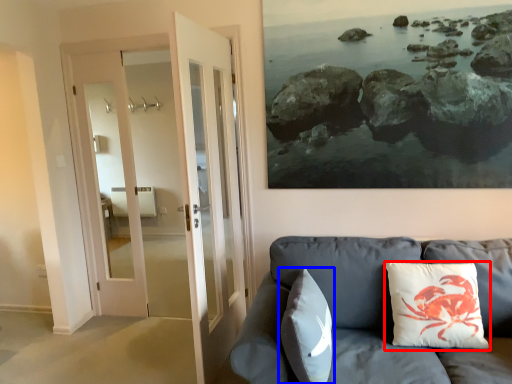
Question: Which of the following is the closest to the observer, pillow (highlighted by a red box) or pillow (highlighted by a blue box)?

Choices:
 (A) pillow
 (B) pillow

Answer: (B)